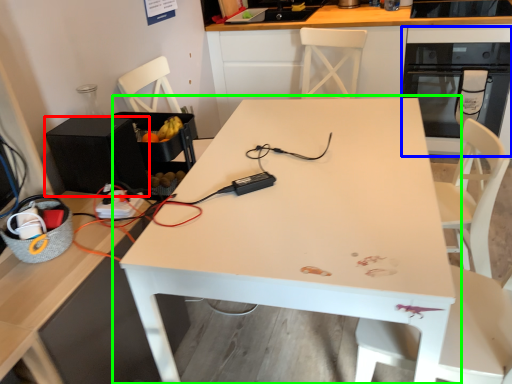
Question: Which is nearer to the appliance (highlighted by a red box)? oven (highlighted by a blue box) or table (highlighted by a green box).

Choices:
 (A) oven
 (B) table

Answer: (B)